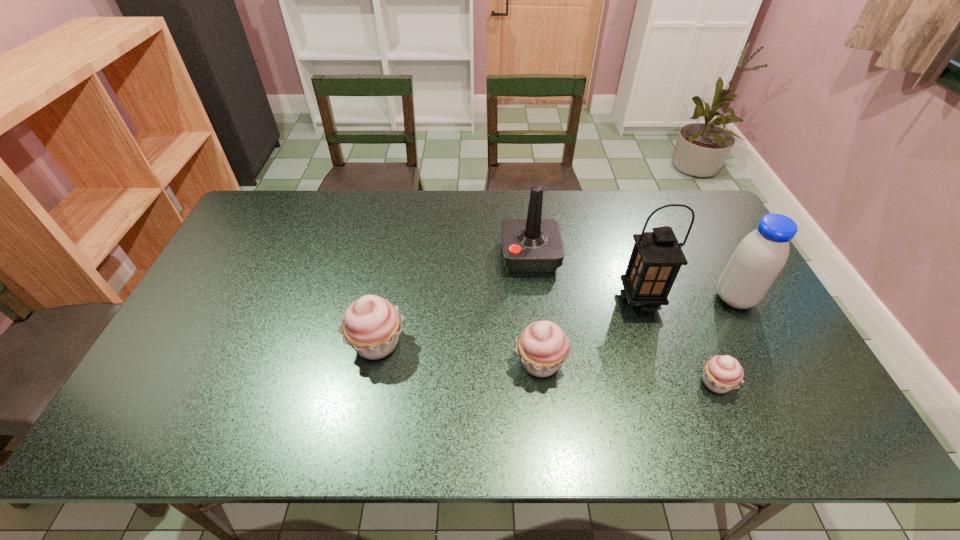
Locate an element on the screen. This screenshot has height=540, width=960. vacant point at the far right corner is located at coordinates (668, 194).

Image resolution: width=960 pixels, height=540 pixels. I want to click on free space between the shortest cupcake and the fifth tallest object, so click(x=628, y=373).

Where is `vacant area that lies between the leftmost cupcake and the joystick`? vacant area that lies between the leftmost cupcake and the joystick is located at coordinates (453, 300).

Where is `free area in between the fifth object from left to right and the lantern`? Image resolution: width=960 pixels, height=540 pixels. free area in between the fifth object from left to right and the lantern is located at coordinates (678, 341).

What are the coordinates of `free point between the rightmost object and the tallest object` in the screenshot? It's located at pos(687,299).

Where is `free spot between the farthest object and the shortest cupcake`? free spot between the farthest object and the shortest cupcake is located at coordinates (623, 319).

Identify the location of empty location between the leftmost cupcake and the tallest object. (509, 321).

Find the location of a particular element. Image resolution: width=960 pixels, height=540 pixels. free space between the third object from right to left and the joystick is located at coordinates (586, 278).

Choose which object is the nearest neighbor to the leftmost object. Please provide its 2D coordinates. Your answer should be formatted as a tuple, i.e. [(x, y)], where the tuple contains the x and y coordinates of a point satisfying the conditions above.

[(542, 346)]

Identify which object is the fourth closest to the farthest object. Please provide its 2D coordinates. Your answer should be formatted as a tuple, i.e. [(x, y)], where the tuple contains the x and y coordinates of a point satisfying the conditions above.

[(722, 373)]